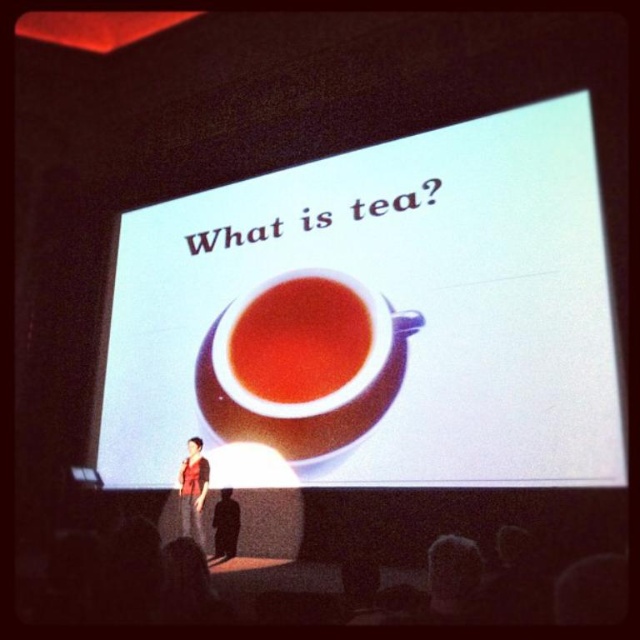
You are sitting in the audience and want to see the translucent glass cup at center clearly during the presentation. The screen is 10 feet away from you. How much closer should you move to the screen to ensure the cup is in focus?

The translucent glass cup at center is 24.49 feet away from the viewer. Since the screen is 10 feet away, you need to move 14.49 feet closer to the screen to be 24.49 feet away from the cup.

Consider the image. You are sitting in the audience and want to know which object is nearer to you between the white glossy cup at center and the red shirt at center. Based on the scene, which one is closer?

The white glossy cup at center is closer to the viewer than the red shirt at center.

Based on the scene description, where is the white glossy cup at center located in terms of its 2D coordinates?

The white glossy cup at center is located at the 2D coordinates point (376, 317).